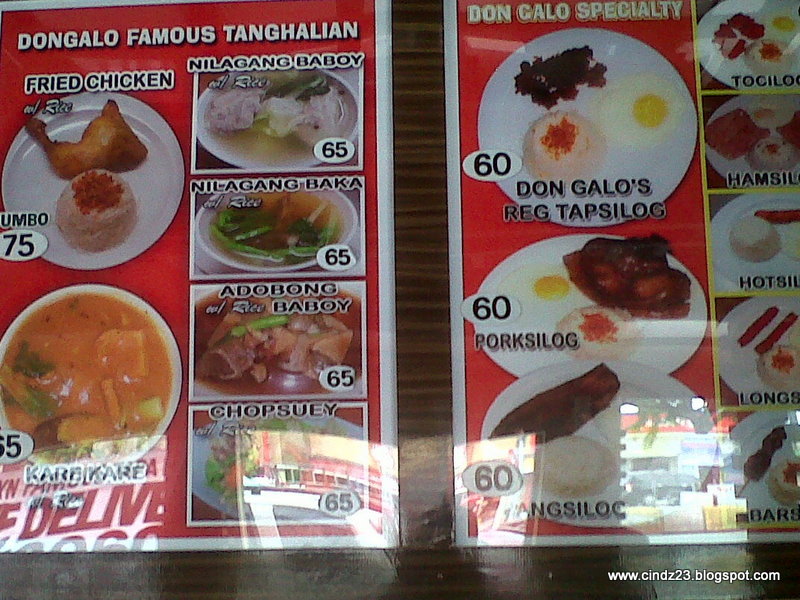
Locate an element on the screen. The image size is (800, 600). glares on table is located at coordinates (434, 482), (330, 576), (92, 560), (680, 552), (490, 45).